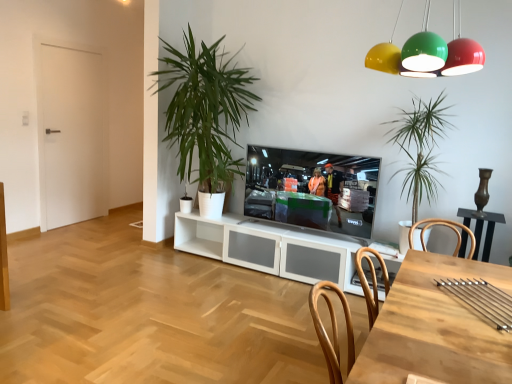
Question: Looking at their shapes, would you say matte black television at center is wider or thinner than white matte door at left?

Choices:
 (A) thin
 (B) wide

Answer: (B)

Question: Considering the positions of matte black television at center and white matte door at left in the image, is matte black television at center taller or shorter than white matte door at left?

Choices:
 (A) tall
 (B) short

Answer: (B)

Question: Estimate the real-world distances between objects in this image. Which object is closer to the white matte door at left?

Choices:
 (A) green leafy plant at center, placed as the 1th houseplant when sorted from right to left
 (B) matte black television at center
 (C) green leafy plant at center, the second houseplant when ordered from right to left
 (D) metallic dome lights at upper center
 (E) wooden table at lower right

Answer: (C)

Question: Which of these objects is positioned closest to the matte black television at center?

Choices:
 (A) green leafy plant at center, which ranks as the second houseplant in left-to-right order
 (B) white matte door at left
 (C) metallic dome lights at upper center
 (D) green leafy plant at center, the second houseplant when ordered from right to left
 (E) wooden table at lower right

Answer: (A)